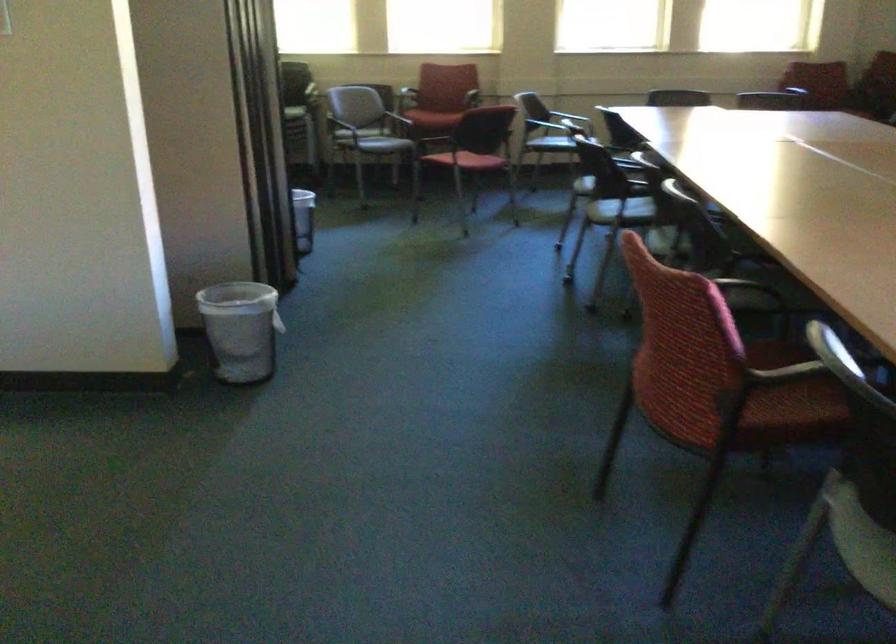
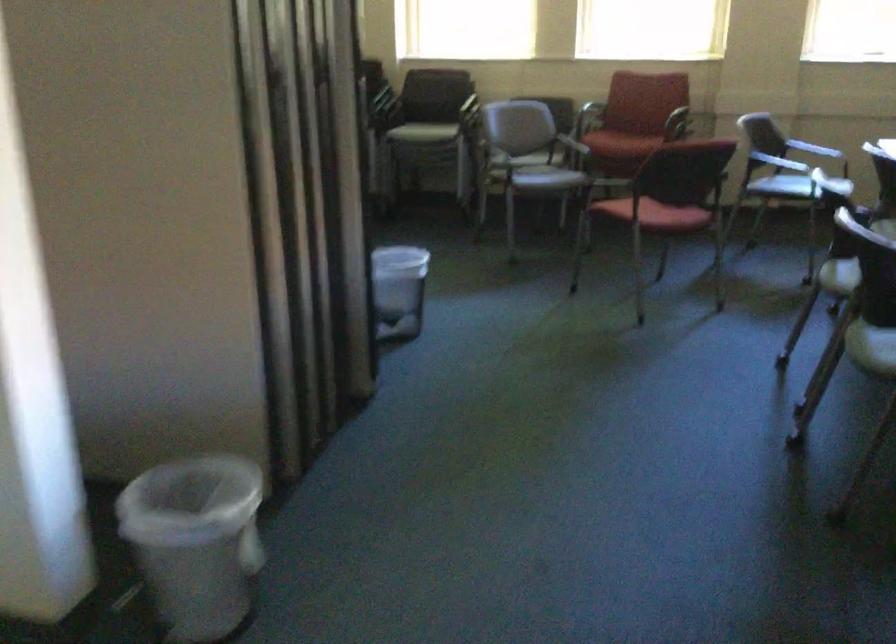
The point at (608,207) is marked in the first image. Where is the corresponding point in the second image?

(871, 336)